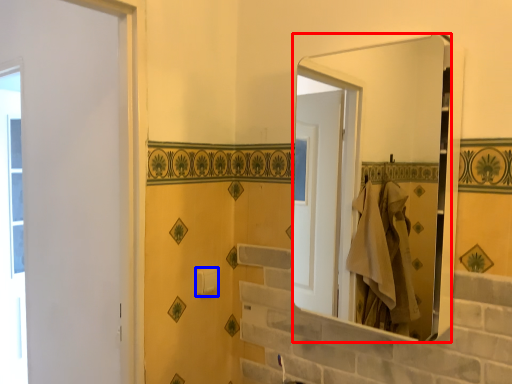
Question: Which of the following is the farthest to the observer, mirror (highlighted by a red box) or towel bar (highlighted by a blue box)?

Choices:
 (A) mirror
 (B) towel bar

Answer: (B)